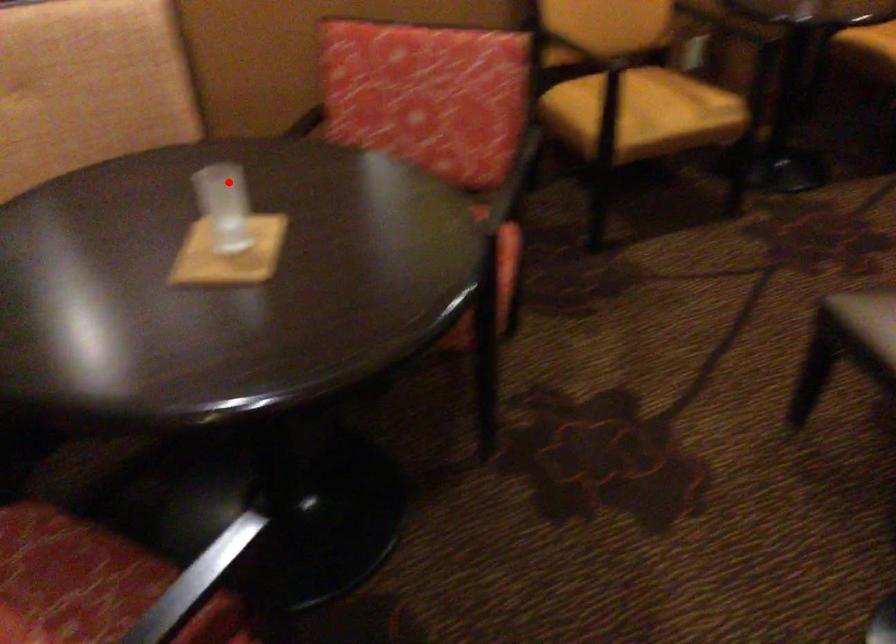
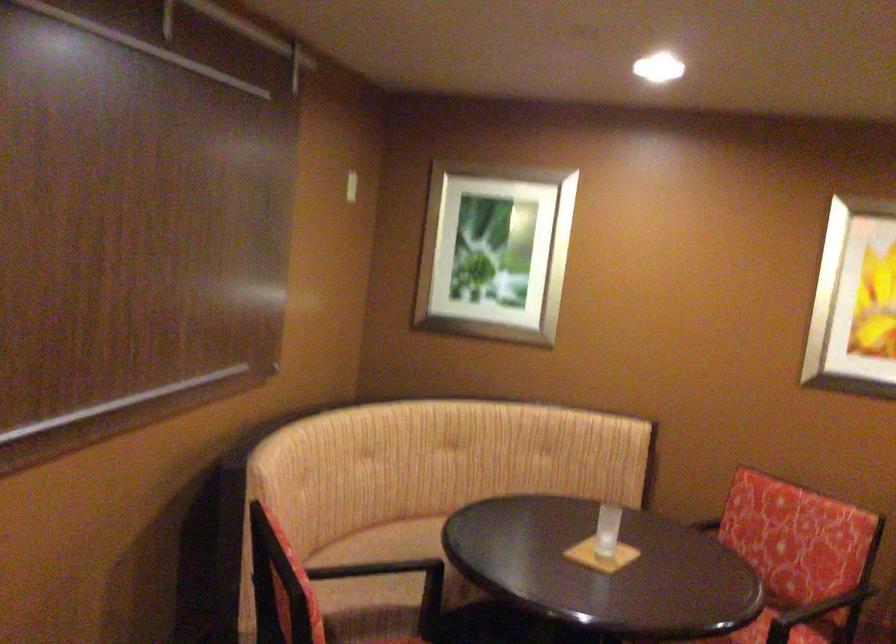
Where in the second image is the point corresponding to the highlighted location from the first image?

(607, 529)